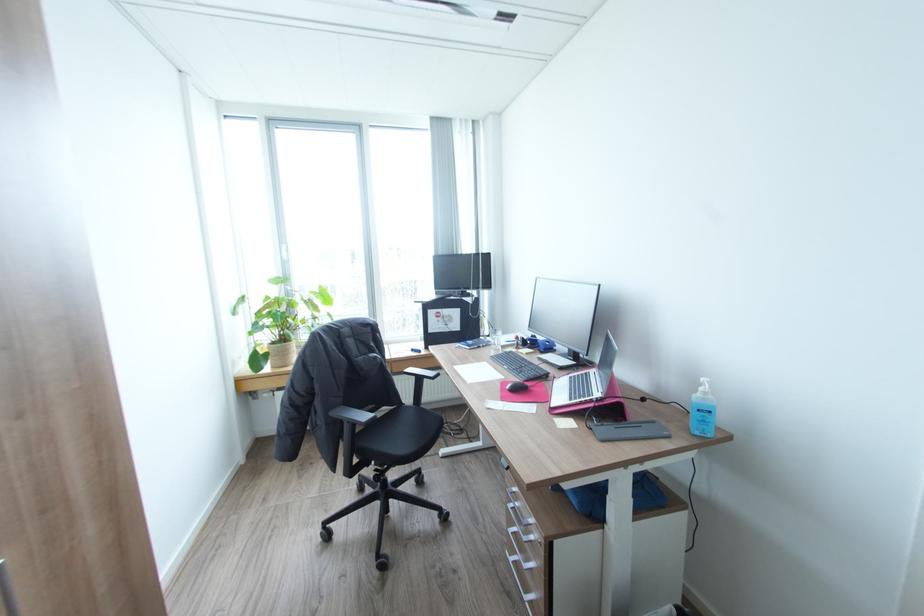
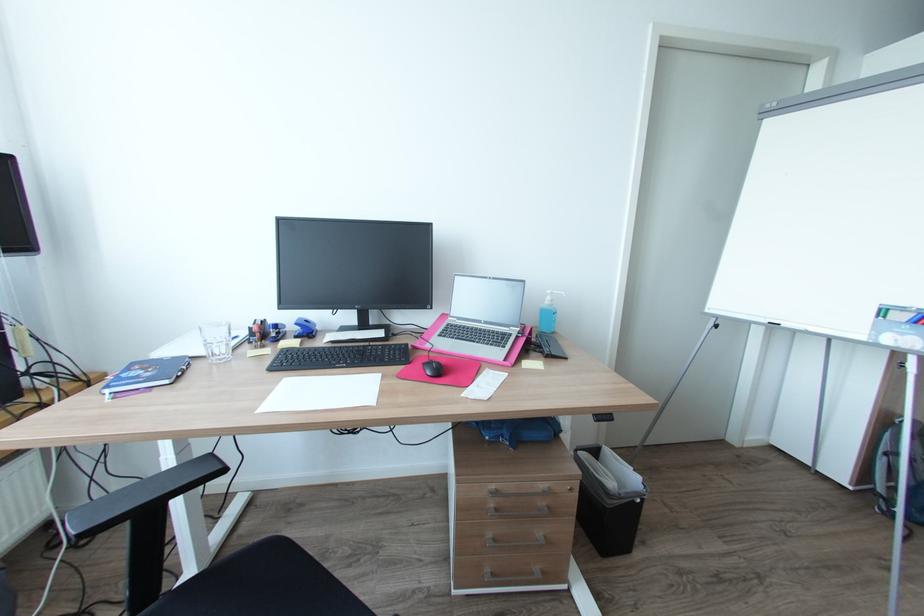
In the second image, find the point that corresponds to point (472, 347) in the first image.

(171, 381)